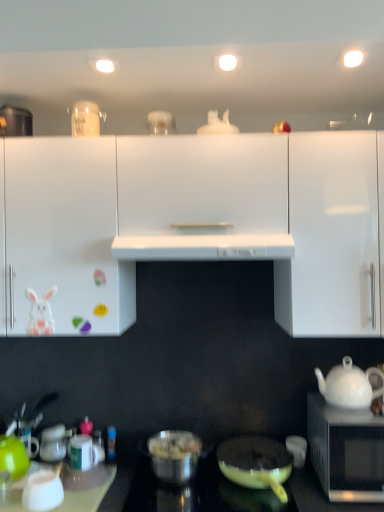
What are the coordinates of `blank area beneath shiny metallic pot at center, which is the 1th pot/pan from left to right (from a real-world perspective)` in the screenshot? It's located at (186, 476).